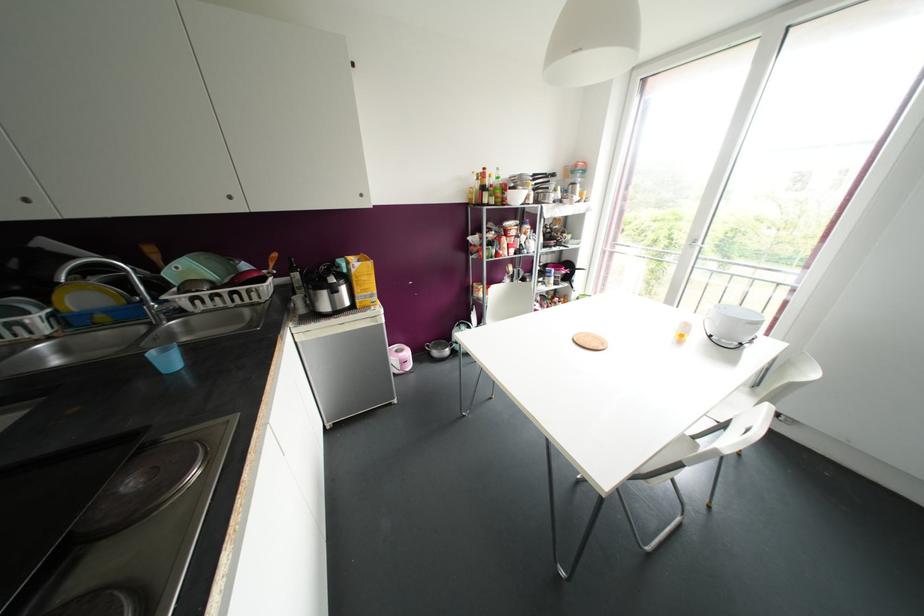
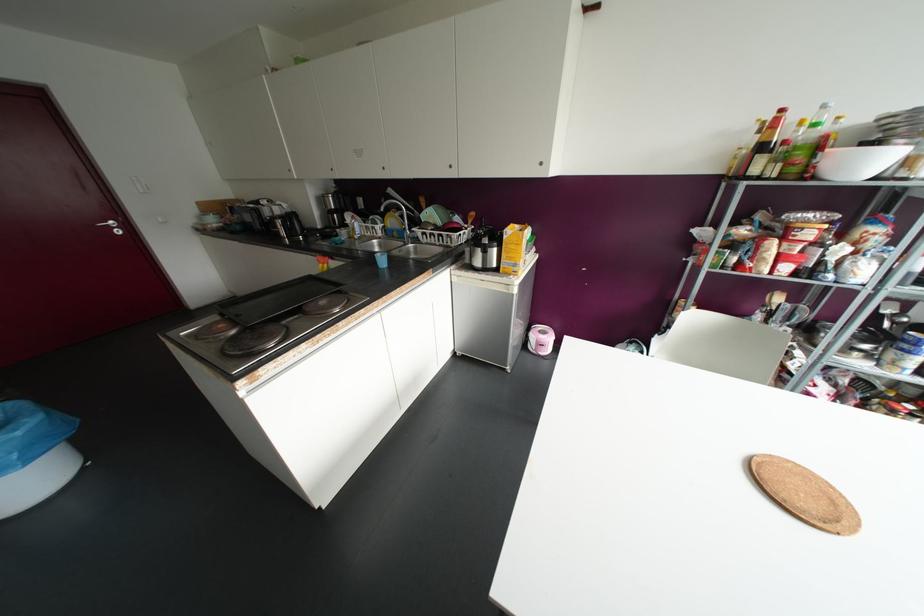
Question: The images are taken continuously from a first-person perspective. In which direction is your viewpoint rotating?

Choices:
 (A) Left
 (B) Right
 (C) Up
 (D) Down

Answer: (A)